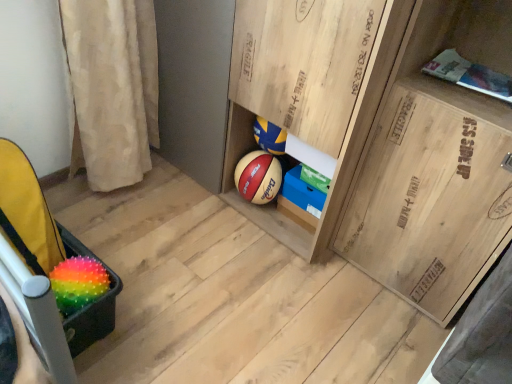
Where is `vacant area that is in front of wooden crate at right, which appears as the first cabinetry when viewed from the right`? The height and width of the screenshot is (384, 512). vacant area that is in front of wooden crate at right, which appears as the first cabinetry when viewed from the right is located at coordinates (376, 329).